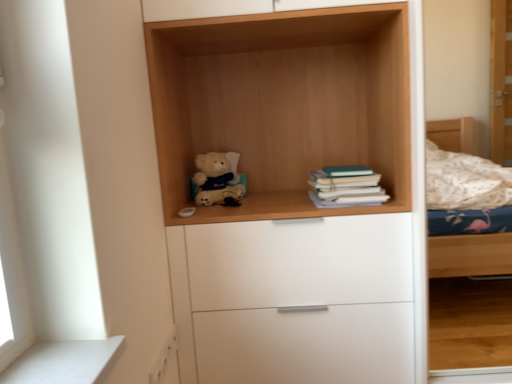
Question: Is the position of teal matte book at center right more distant than that of light wood/texture teddy bear at center?

Choices:
 (A) yes
 (B) no

Answer: (A)

Question: Can you confirm if teal matte book at center right is wider than light wood/texture teddy bear at center?

Choices:
 (A) no
 (B) yes

Answer: (A)

Question: Is teal matte book at center right taller than light wood/texture teddy bear at center?

Choices:
 (A) yes
 (B) no

Answer: (B)

Question: Can you confirm if teal matte book at center right is positioned to the left of light wood/texture teddy bear at center?

Choices:
 (A) no
 (B) yes

Answer: (A)

Question: Would you say teal matte book at center right is outside light wood/texture teddy bear at center?

Choices:
 (A) no
 (B) yes

Answer: (A)

Question: From the image's perspective, would you say teal matte book at center right is shown under light wood/texture teddy bear at center?

Choices:
 (A) no
 (B) yes

Answer: (B)

Question: From the image's perspective, is white matte chest of drawers at center on teal matte book at center right?

Choices:
 (A) yes
 (B) no

Answer: (B)

Question: Does white matte chest of drawers at center have a greater width compared to teal matte book at center right?

Choices:
 (A) no
 (B) yes

Answer: (B)

Question: Is white matte chest of drawers at center positioned far away from teal matte book at center right?

Choices:
 (A) yes
 (B) no

Answer: (B)

Question: Is white matte chest of drawers at center located outside teal matte book at center right?

Choices:
 (A) yes
 (B) no

Answer: (A)

Question: Is teal matte book at center right inside white matte chest of drawers at center?

Choices:
 (A) yes
 (B) no

Answer: (B)

Question: Is white matte chest of drawers at center facing away from teal matte book at center right?

Choices:
 (A) no
 (B) yes

Answer: (A)

Question: Is light wood/texture teddy bear at center surrounded by white matte chest of drawers at center?

Choices:
 (A) yes
 (B) no

Answer: (B)